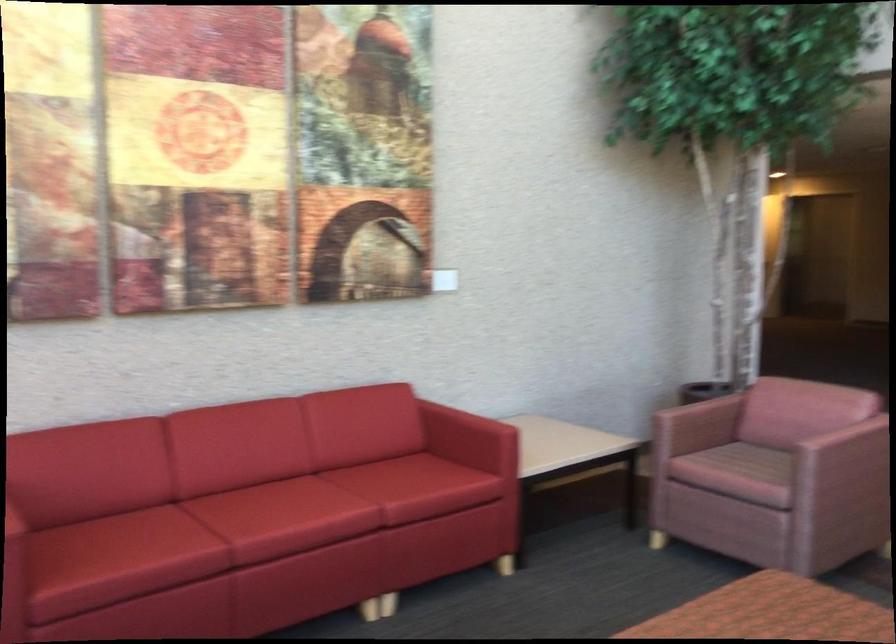
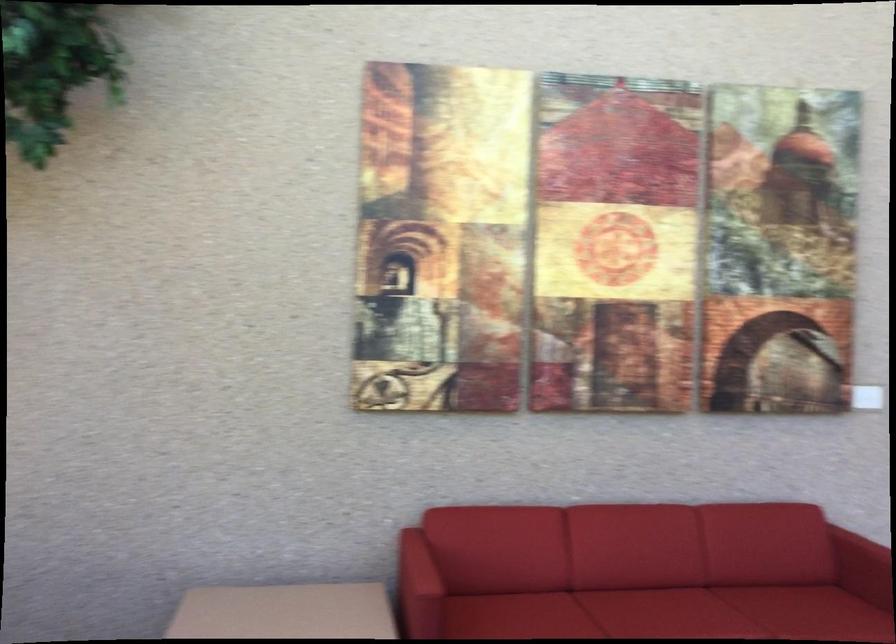
Locate, in the second image, the point that corresponds to (446,422) in the first image.

(864, 558)